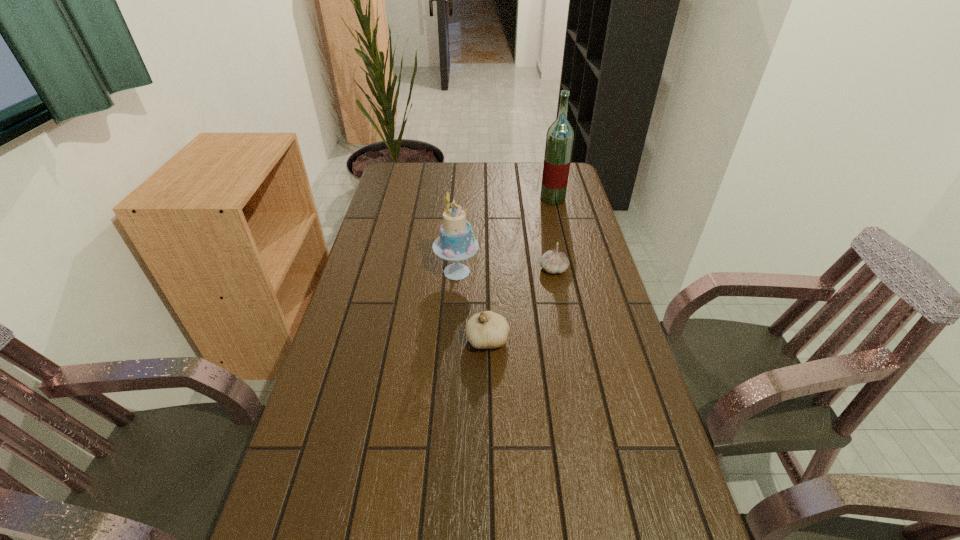
Where is `liquor`? liquor is located at coordinates (559, 140).

Image resolution: width=960 pixels, height=540 pixels. I want to click on the tallest object, so click(x=559, y=140).

Find the location of a particular element. The height and width of the screenshot is (540, 960). the third shortest object is located at coordinates (456, 242).

Locate an element on the screen. The width and height of the screenshot is (960, 540). the nearest object is located at coordinates [486, 330].

This screenshot has width=960, height=540. In order to click on the nearer garlic in this screenshot , I will do `click(486, 330)`.

Locate an element on the screen. The height and width of the screenshot is (540, 960). the farther garlic is located at coordinates (553, 261).

Identify the location of vacant region located on the front of the tallest object. (566, 255).

The height and width of the screenshot is (540, 960). Find the location of `vacant space located with a ladder on the side of the cake`. vacant space located with a ladder on the side of the cake is located at coordinates (516, 272).

You are a GUI agent. You are given a task and a screenshot of the screen. Output one action in this format:
    pyautogui.click(x=<x>, y=<y>)
    Task: Click on the free location located 0.140m on the front of the nearest object
    
    Given the screenshot: What is the action you would take?
    pyautogui.click(x=489, y=404)

You are a GUI agent. You are given a task and a screenshot of the screen. Output one action in this format:
    pyautogui.click(x=<x>, y=<y>)
    Task: Click on the blank space located on the left of the right garlic
    This screenshot has width=960, height=540.
    Given the screenshot: What is the action you would take?
    pyautogui.click(x=480, y=269)